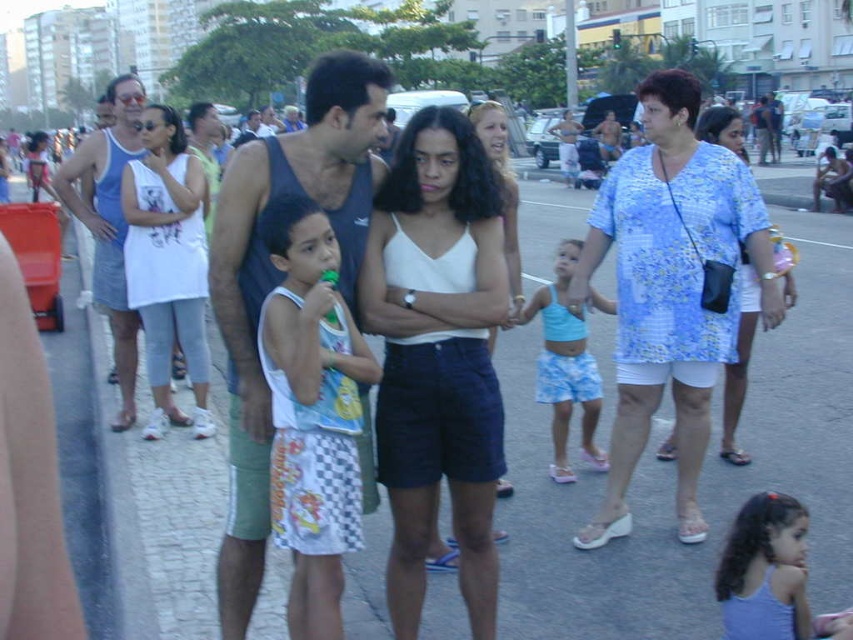
Question: Which of the following is the farthest from the observer?

Choices:
 (A) white cotton tank top at left
 (B) light blue fabric shorts at center

Answer: (A)

Question: Is light purple fabric dress at lower right further to camera compared to blue floral dress at center?

Choices:
 (A) no
 (B) yes

Answer: (A)

Question: Which object is closer to the camera taking this photo?

Choices:
 (A) white cotton tank top at center
 (B) blue floral blouse at center
 (C) matte blue tank top at center
 (D) white matte tank top at center

Answer: (C)

Question: Among these points, which one is nearest to the camera?

Choices:
 (A) (724, 115)
 (B) (764, 525)
 (C) (598, 392)
 (D) (509, 292)

Answer: (B)

Question: Does matte blue tank top at center appear under light purple fabric dress at lower right?

Choices:
 (A) yes
 (B) no

Answer: (B)

Question: Does blue floral dress at center come in front of white matte tank top at center?

Choices:
 (A) yes
 (B) no

Answer: (B)